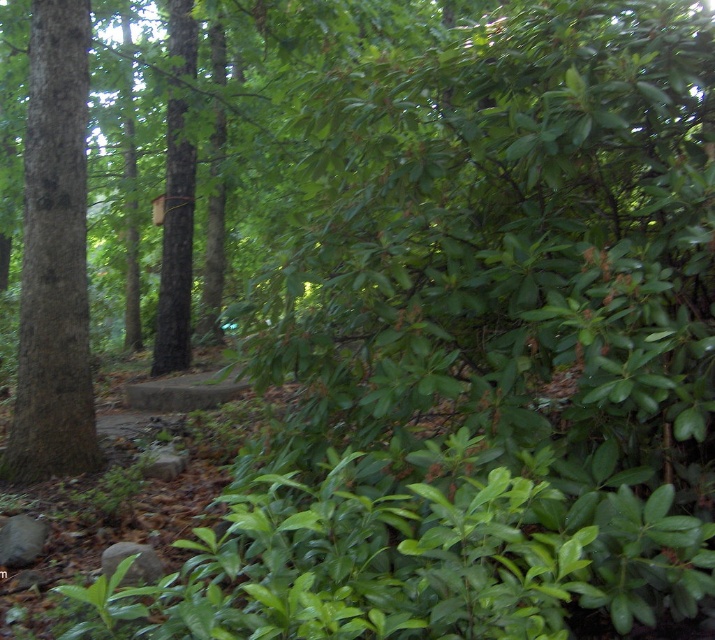
Between smooth brown tree trunk at left and brown wood birdhouse at center, which one is positioned higher?

Positioned higher is brown wood birdhouse at center.

Image resolution: width=715 pixels, height=640 pixels. Find the location of `smooth brown tree trunk at left`. smooth brown tree trunk at left is located at coordinates (54, 257).

Which is behind, point (54, 209) or point (182, 100)?

Point (182, 100)

Find the location of a particular element. Image resolution: width=715 pixels, height=640 pixels. smooth brown tree trunk at left is located at coordinates (54, 257).